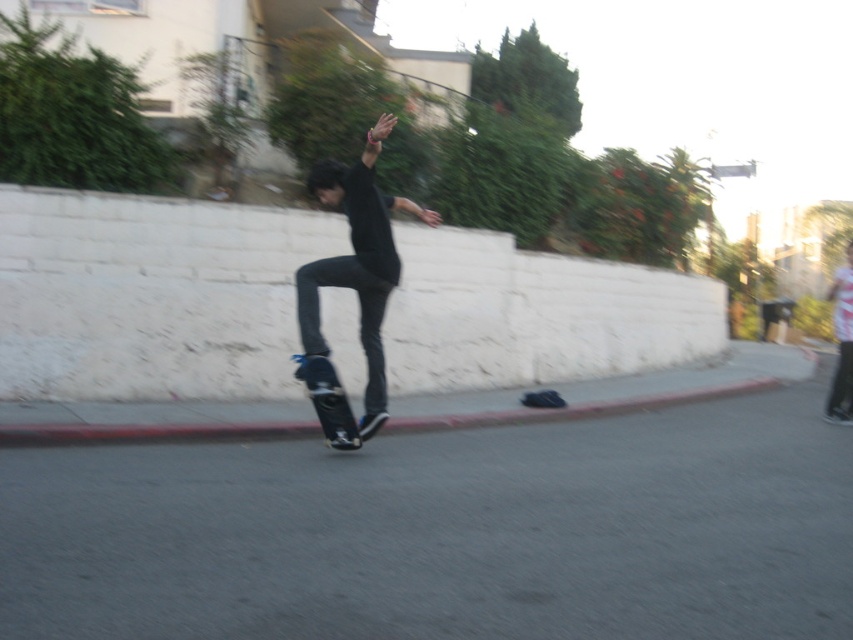
Is gray asphalt pavement at center taller than matte black skateboard at center?

In fact, gray asphalt pavement at center may be shorter than matte black skateboard at center.

Can you confirm if gray asphalt pavement at center is wider than matte black skateboard at center?

No.

Where is `gray asphalt pavement at center`? gray asphalt pavement at center is located at coordinates (445, 531).

Measure the distance between gray asphalt pavement at center and black matte skateboard at center.

They are 7.26 feet apart.

Does gray asphalt pavement at center appear under black matte skateboard at center?

Indeed, gray asphalt pavement at center is positioned under black matte skateboard at center.

Who is more distant from viewer, [260,550] or [354,438]?

Positioned behind is point [354,438].

Locate an element on the screen. gray asphalt pavement at center is located at coordinates (445, 531).

Who is lower down, matte black skateboard at center or black matte skateboard at center?

Positioned lower is black matte skateboard at center.

Is matte black skateboard at center closer to camera compared to black matte skateboard at center?

Yes, matte black skateboard at center is in front of black matte skateboard at center.

Who is more forward, (380, 362) or (329, 429)?

Positioned in front is point (329, 429).

At what (x,y) coordinates should I click in order to perform the action: click on matte black skateboard at center. Please return your answer as a coordinate pair (x, y). Image resolution: width=853 pixels, height=640 pixels. Looking at the image, I should click on (357, 262).